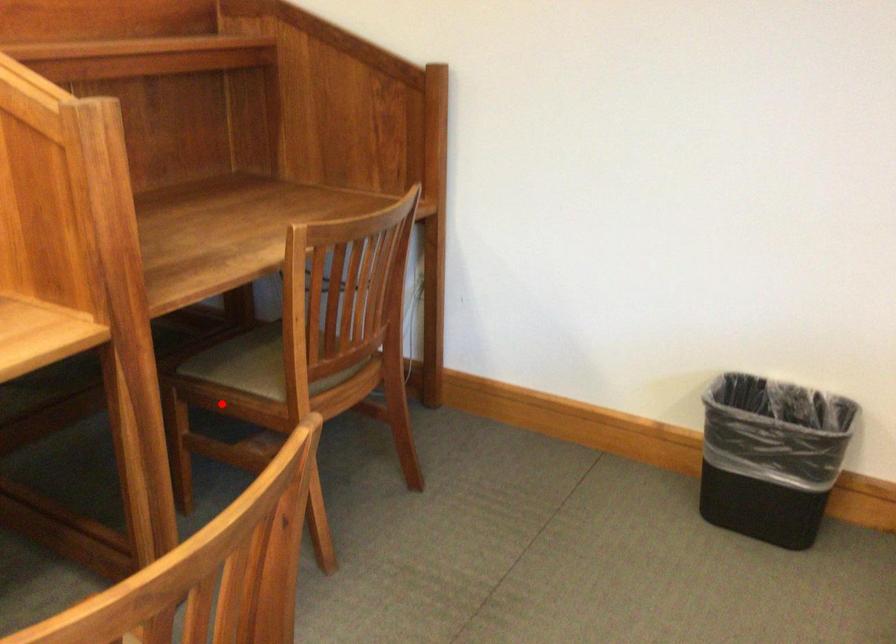
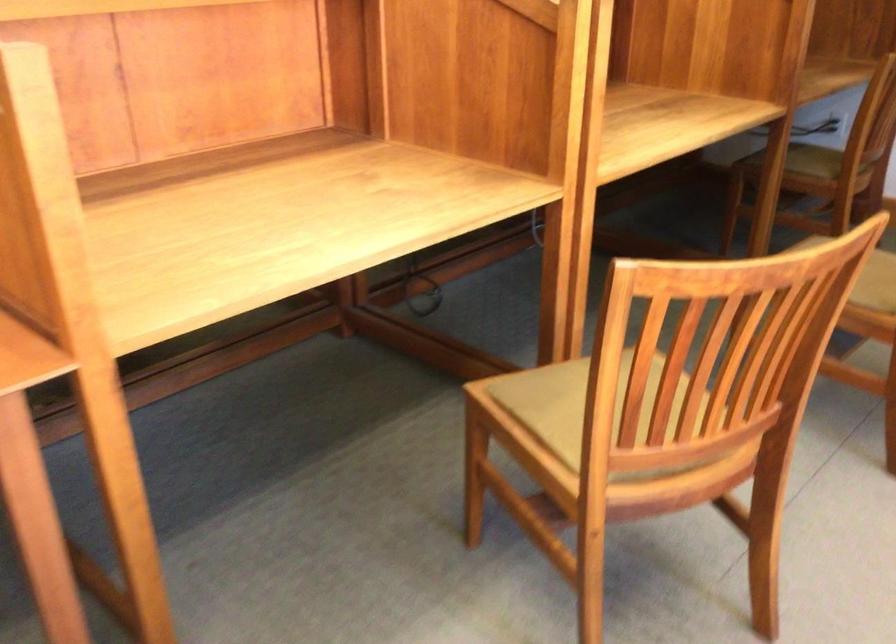
Where in the second image is the point corresponding to the highlighted location from the first image?

(814, 161)